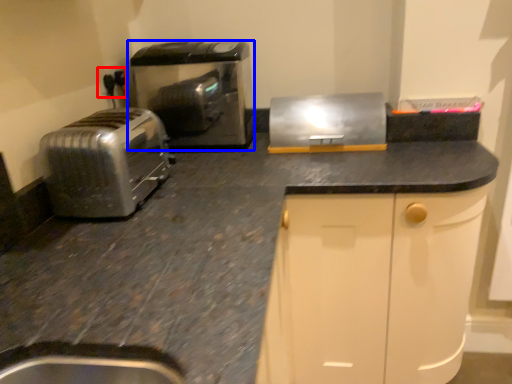
Question: Which point is closer to the camera, electric outlet (highlighted by a red box) or home appliance (highlighted by a blue box)?

Choices:
 (A) electric outlet
 (B) home appliance

Answer: (B)